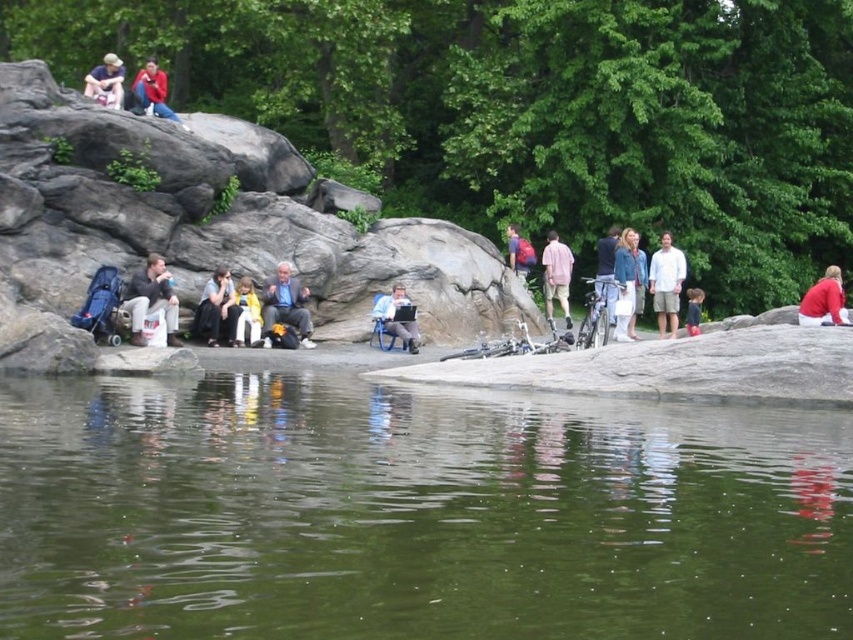
You are standing at the center of the image and want to place a new bench for visitors. The bench must be placed at least 1 meter away from the nearest object. Is the point at coordinates point (286,304) suitable for placing the bench?

The point at coordinates point (286,304) has a matte gray jacket at center, so placing the bench there would be too close to the jacket. Choose a different location.

You are a photographer planning to take a group photo of the people in the scene. You need to ensure that both the matte red jacket at upper left and the light pink fabric dress at center are clearly visible. Given their sizes, which object should you focus on to ensure both are in frame and properly exposed?

The matte red jacket at upper left is larger than the light pink fabric dress at center. To ensure both are in frame and properly exposed, focus on the matte red jacket at upper left first, as its larger size will require more attention to capture details, and then adjust the exposure to include the light pink fabric dress at center.